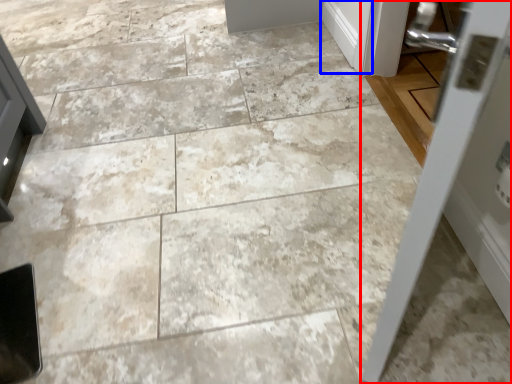
Question: Which object appears closest to the camera in this image, door (highlighted by a red box) or door (highlighted by a blue box)?

Choices:
 (A) door
 (B) door

Answer: (A)